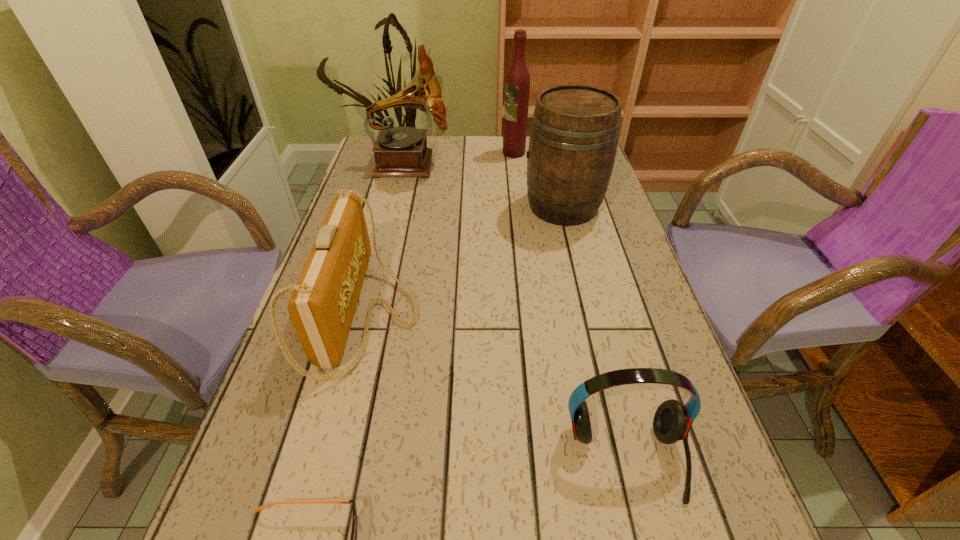
This screenshot has width=960, height=540. I want to click on liquor, so click(x=517, y=84).

You are a GUI agent. You are given a task and a screenshot of the screen. Output one action in this format:
    pyautogui.click(x=<x>, y=<y>)
    Task: Click on the phonograph_record
    Image resolution: width=960 pixels, height=540 pixels.
    Given the screenshot: What is the action you would take?
    pyautogui.click(x=401, y=152)

You are a GUI agent. You are given a task and a screenshot of the screen. Output one action in this format:
    pyautogui.click(x=<x>, y=<y>)
    Task: Click on the cider
    
    Given the screenshot: What is the action you would take?
    pyautogui.click(x=574, y=134)

What are the coordinates of `the fourth nearest object` in the screenshot? It's located at (574, 134).

The width and height of the screenshot is (960, 540). In order to click on handbag in this screenshot , I will do `click(322, 306)`.

Where is `the third shortest object`? Image resolution: width=960 pixels, height=540 pixels. the third shortest object is located at coordinates (322, 306).

Find the location of `the second nearest object`. the second nearest object is located at coordinates (672, 420).

What are the coordinates of `the second shortest object` in the screenshot? It's located at (672, 420).

In order to click on vacant space located 0.400m on the label of the liquor in this screenshot , I will do `click(379, 153)`.

Locate an element on the screen. The height and width of the screenshot is (540, 960). free space located 0.350m on the label of the liquor is located at coordinates (395, 153).